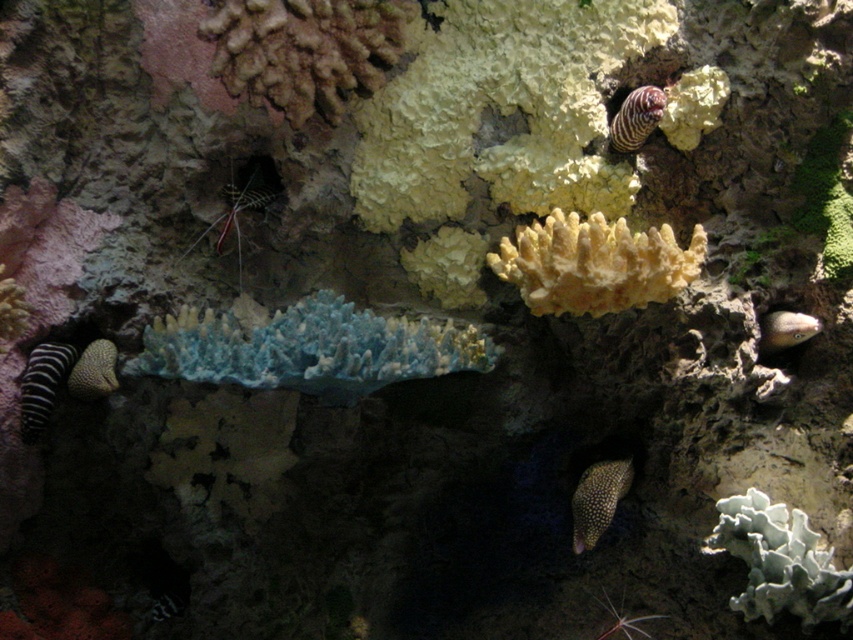
Question: Is yellow matte coral at center to the left of zebra-striped eel at upper right from the viewer's perspective?

Choices:
 (A) yes
 (B) no

Answer: (A)

Question: Which object appears closest to the camera in this image?

Choices:
 (A) black striped fish at lower left
 (B) zebra-striped eel at upper right

Answer: (B)

Question: From the image, what is the correct spatial relationship of black striped fish at lower left in relation to zebra-striped eel at upper right?

Choices:
 (A) right
 (B) left

Answer: (B)

Question: Is blue translucent coral at center above smooth gray fish at right?

Choices:
 (A) yes
 (B) no

Answer: (B)

Question: Which point is farther from the camera taking this photo?

Choices:
 (A) (619, 273)
 (B) (496, 358)

Answer: (B)

Question: Estimate the real-world distances between objects in this image. Which object is closer to the speckled yellow fish at lower center?

Choices:
 (A) black striped fish at lower left
 (B) yellow matte coral at center
 (C) smooth gray fish at right

Answer: (C)